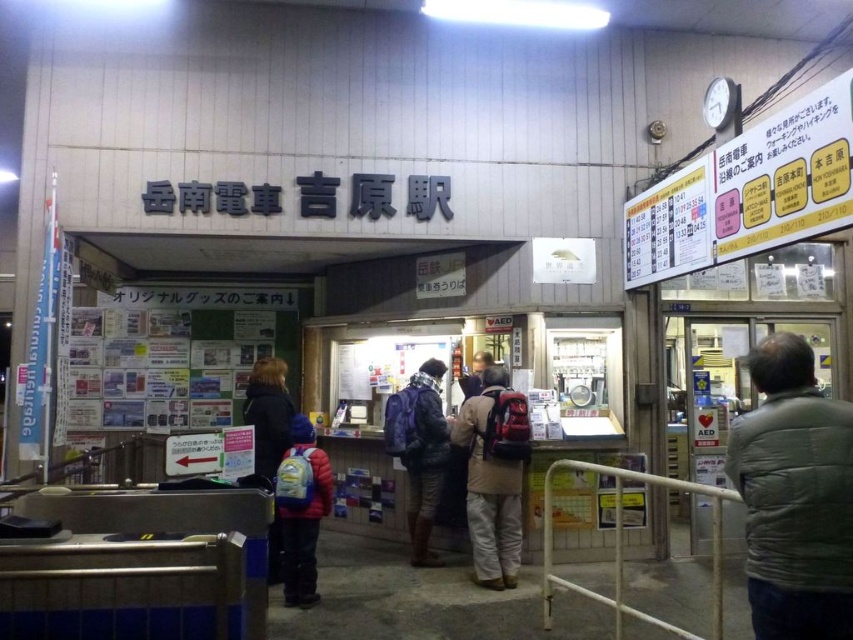
Is point (296, 456) positioned behind point (254, 428)?

No, (296, 456) is in front of (254, 428).

Between matte blue backpack at lower left and dark blue jacket at left, which one is positioned lower?

matte blue backpack at lower left is lower down.

Does point (289, 564) come closer to viewer compared to point (258, 428)?

That is True.

Where is `matte blue backpack at lower left`? The image size is (853, 640). matte blue backpack at lower left is located at coordinates [302, 515].

What do you see at coordinates (491, 484) in the screenshot?
I see `matte brown backpack at center` at bounding box center [491, 484].

Image resolution: width=853 pixels, height=640 pixels. I want to click on matte brown backpack at center, so click(x=491, y=484).

Who is positioned more to the left, green quilted jacket at right or matte blue backpack at center?

matte blue backpack at center

Based on the photo, who is shorter, green quilted jacket at right or matte blue backpack at center?

green quilted jacket at right is shorter.

This screenshot has width=853, height=640. I want to click on green quilted jacket at right, so tap(793, 497).

Find the location of `green quilted jacket at right`. green quilted jacket at right is located at coordinates (793, 497).